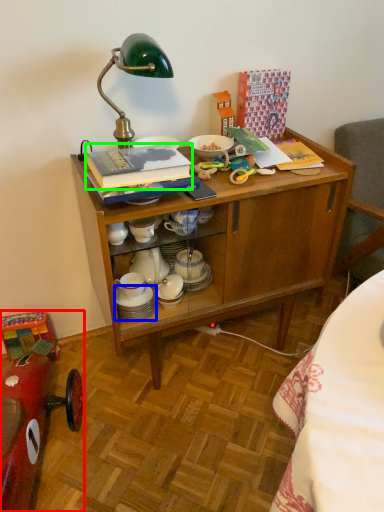
Question: Which object is the farthest from model car (highlighted by a red box)? Choose among these: tableware (highlighted by a blue box) or book (highlighted by a green box).

Choices:
 (A) tableware
 (B) book

Answer: (B)